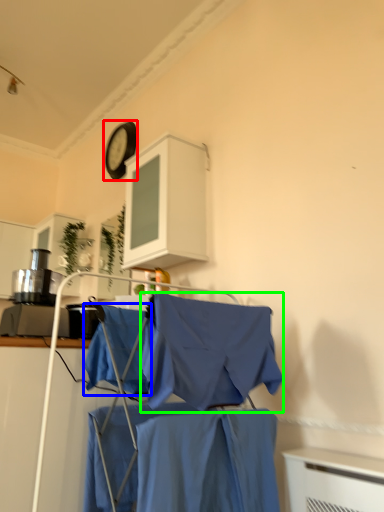
Question: Which object is positioned farthest from clock (highlighted by a red box)? Select from fabric (highlighted by a blue box) and cloak (highlighted by a green box).

Choices:
 (A) fabric
 (B) cloak

Answer: (B)